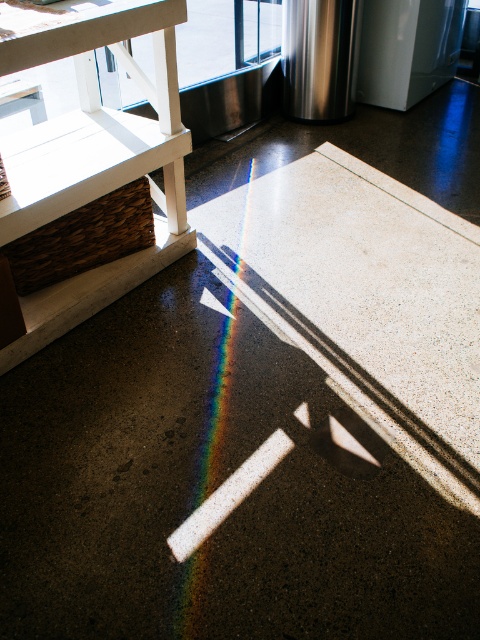
Question: Does transparent glass door at upper center have a smaller size compared to rainbow at center?

Choices:
 (A) no
 (B) yes

Answer: (A)

Question: Estimate the real-world distances between objects in this image. Which object is farther from the stainless steel refrigerator at upper right?

Choices:
 (A) transparent glass door at upper center
 (B) rainbow at center

Answer: (B)

Question: Which point is farther to the camera?

Choices:
 (A) (349, 96)
 (B) (196, 77)

Answer: (B)

Question: Which point is closer to the camera?

Choices:
 (A) (219, 422)
 (B) (335, 51)
 (C) (214, 68)

Answer: (A)

Question: Is transparent glass door at upper center to the left of rainbow at center from the viewer's perspective?

Choices:
 (A) no
 (B) yes

Answer: (B)

Question: In this image, where is transparent glass door at upper center located relative to rainbow at center?

Choices:
 (A) below
 (B) above

Answer: (B)